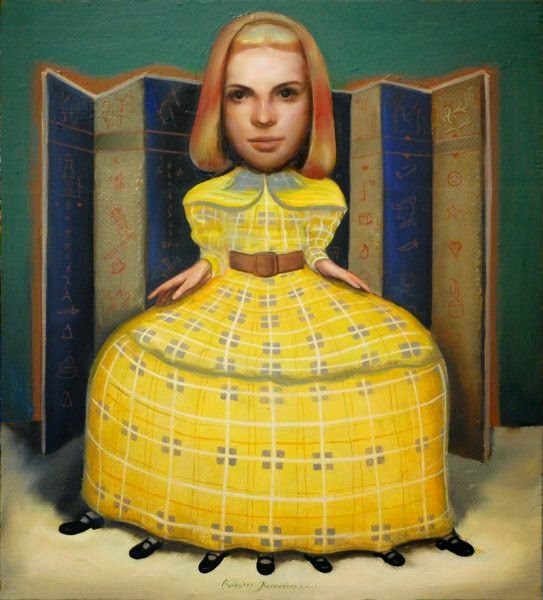
Where is `floor`? The width and height of the screenshot is (543, 600). floor is located at coordinates (479, 460).